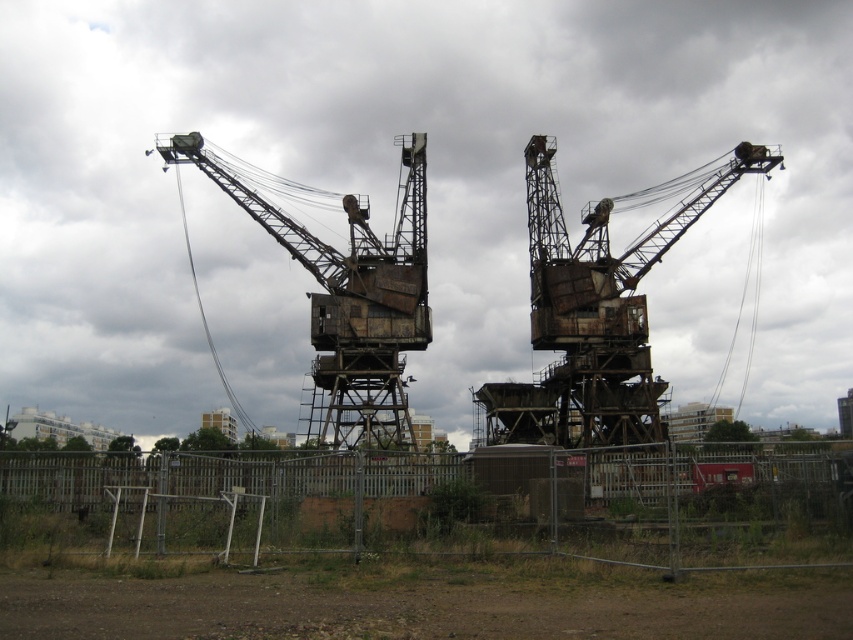
You are standing at the entrance of the abandoned area and want to walk towards the rusty metal crane at center. Which direction should you walk relative to the metal fence at lower center?

You should walk to the left of the metal fence at lower center to reach the rusty metal crane at center because the metal fence at lower center is to the right of the rusty metal crane at center.

You are standing at the entrance of the abandoned area and want to reach the metal fence at lower center. What direction should you walk to reach it?

The metal fence at lower center is located at point (451,504), so you should walk forward to reach it.